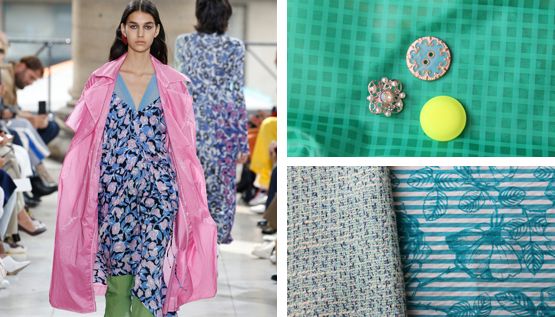
This screenshot has height=317, width=555. I want to click on swatch, so click(x=348, y=283), click(x=463, y=239), click(x=511, y=123).